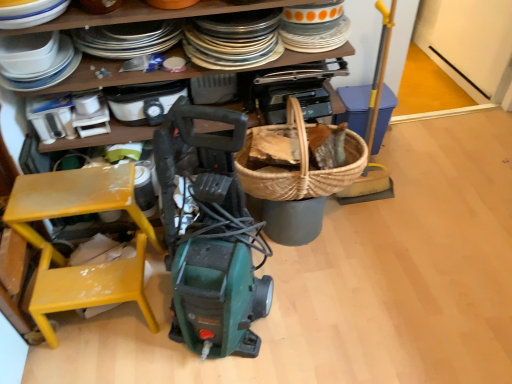
The height and width of the screenshot is (384, 512). In order to click on vacant region above white plastic coffee maker at upper left, the 4th appliance from the right (from a real-world perspective) in this screenshot , I will do `click(46, 97)`.